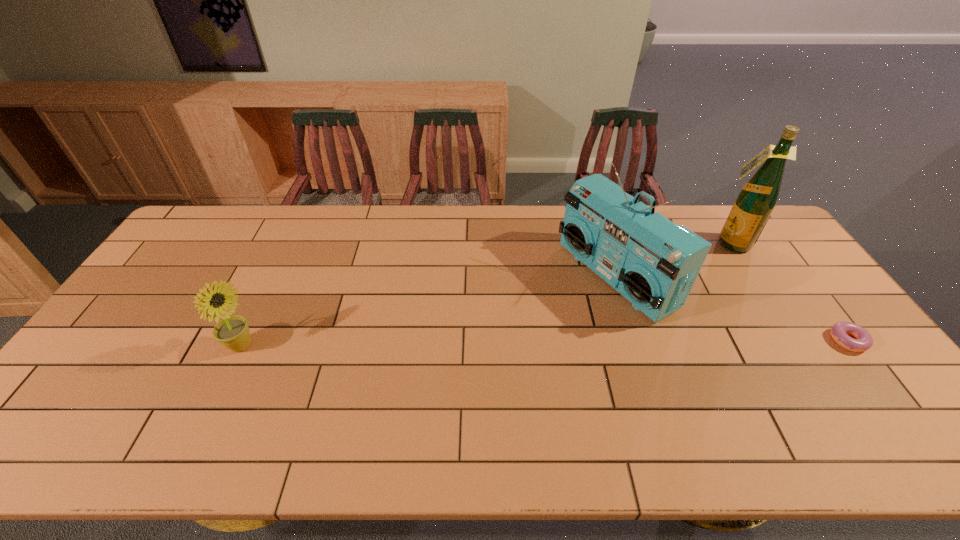
Where is `object positioned at the far right corner`? The image size is (960, 540). object positioned at the far right corner is located at coordinates (755, 202).

The image size is (960, 540). I want to click on free space at the far edge, so click(380, 224).

Identify the location of vacant region at the near edge of the desktop. Image resolution: width=960 pixels, height=540 pixels. (265, 390).

The image size is (960, 540). In order to click on vacant space at the left edge of the desktop in this screenshot , I will do `click(186, 298)`.

You are a GUI agent. You are given a task and a screenshot of the screen. Output one action in this format:
    pyautogui.click(x=<x>, y=<y>)
    Task: Click on the free space at the right edge of the desktop
    This screenshot has height=540, width=960.
    Given the screenshot: What is the action you would take?
    pyautogui.click(x=827, y=347)

Where is `blank area at the far left corner`? blank area at the far left corner is located at coordinates (185, 235).

In the image, there is a desktop. Identify the location of free space at the near left corner. (56, 400).

I want to click on unoccupied position between the rightmost object and the second shortest object, so click(x=545, y=343).

Find the location of `vacant point located between the leftmost object and the radio receiver`. vacant point located between the leftmost object and the radio receiver is located at coordinates (428, 312).

I want to click on free spot between the doughnut and the second object from right to left, so click(x=789, y=292).